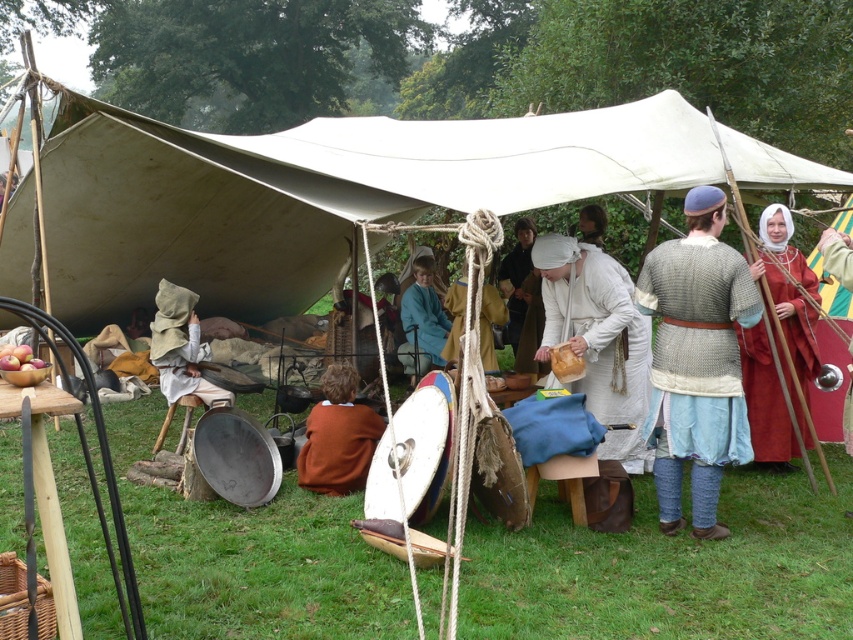
Question: Observing the image, what is the correct spatial positioning of matte red tunic at right in reference to light beige fabric hood at lower left?

Choices:
 (A) left
 (B) right

Answer: (B)

Question: Which of the following is the closest to the observer?

Choices:
 (A) blue woolen cloak at center
 (B) brown leather shield at center
 (C) white linen dress at center
 (D) brown leather bag at center

Answer: (C)

Question: From the image, what is the correct spatial relationship of white linen dress at center in relation to blue woolen cloak at center?

Choices:
 (A) below
 (B) above

Answer: (A)

Question: Observing the image, what is the correct spatial positioning of chainmail shirt at right in reference to blue woolen cloak at center?

Choices:
 (A) right
 (B) left

Answer: (A)

Question: Considering the real-world distances, which object is farthest from the brown leather bag at center?

Choices:
 (A) red leather shield at right
 (B) light beige fabric hood at lower left
 (C) matte red tunic at right
 (D) brown wool sweater at lower center

Answer: (A)

Question: Which object is the closest to the light beige fabric hood at lower left?

Choices:
 (A) white linen dress at center
 (B) matte red tunic at right
 (C) brown wool sweater at lower center
 (D) red leather shield at right

Answer: (C)